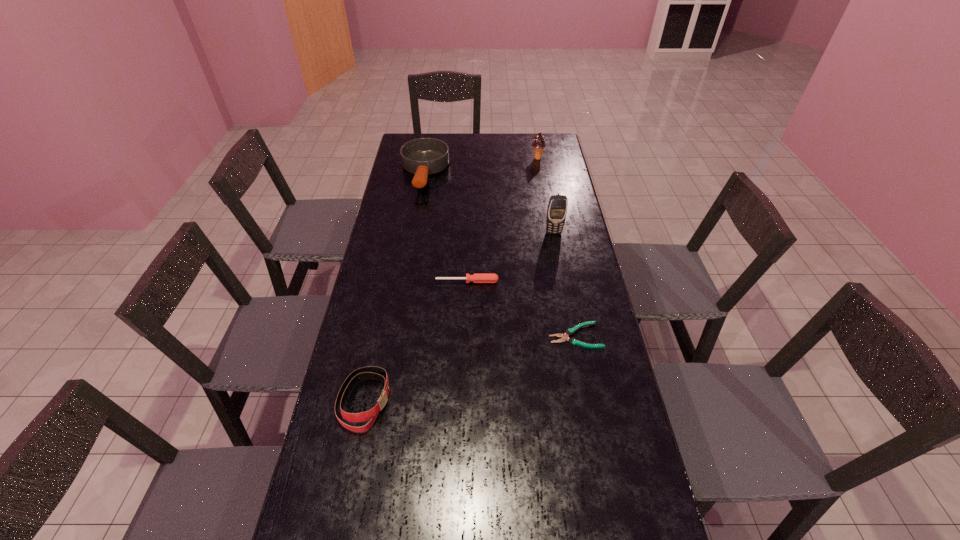
Where is `vacant area that lies between the dog collar and the third nearest object`? vacant area that lies between the dog collar and the third nearest object is located at coordinates (416, 341).

This screenshot has width=960, height=540. In order to click on vacant point located between the pan and the screwdriver in this screenshot , I will do `click(445, 227)`.

Find the location of a particular element. free space between the cellular telephone and the third shortest object is located at coordinates (459, 317).

The width and height of the screenshot is (960, 540). What are the coordinates of `free space between the third farthest object and the third shortest object` in the screenshot? It's located at (459, 317).

This screenshot has height=540, width=960. I want to click on vacant region between the third nearest object and the third shortest object, so click(x=416, y=341).

The image size is (960, 540). I want to click on vacant area that lies between the cellular telephone and the fifth tallest object, so click(511, 257).

I want to click on free spot between the fourth nearest object and the third nearest object, so click(x=511, y=257).

Identify the location of vacant area that lies between the icecream and the fourth farthest object. (x=502, y=220).

Find the location of `object that is the second closest to the nearest object`. object that is the second closest to the nearest object is located at coordinates (564, 337).

Identify which object is the fifth closest to the tallest object. Please provide its 2D coordinates. Your answer should be formatted as a tuple, i.e. [(x, y)], where the tuple contains the x and y coordinates of a point satisfying the conditions above.

[(371, 371)]